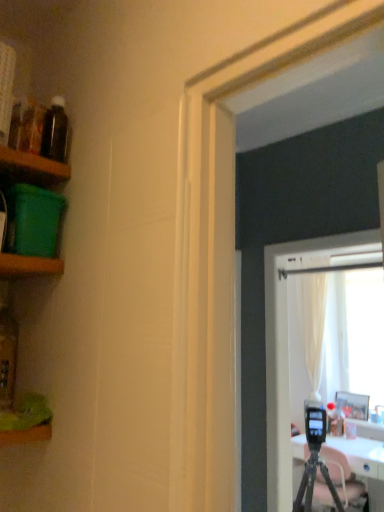
Question: Considering the relative sizes of green plastic container at left, marked as the 2th shelf in a bottom-to-top arrangement, and green plastic container at left, which ranks as the third shelf in bottom-to-top order, in the image provided, is green plastic container at left, marked as the 2th shelf in a bottom-to-top arrangement, thinner than green plastic container at left, which ranks as the third shelf in bottom-to-top order,?

Choices:
 (A) no
 (B) yes

Answer: (B)

Question: From the image's perspective, is green plastic container at left, which appears as the second shelf when viewed from the top, on green plastic container at left, the 1th shelf in the top-to-bottom sequence?

Choices:
 (A) yes
 (B) no

Answer: (B)

Question: Does green plastic container at left, which appears as the second shelf when viewed from the top, appear on the right side of green plastic container at left, the 1th shelf in the top-to-bottom sequence?

Choices:
 (A) no
 (B) yes

Answer: (B)

Question: Can green plastic container at left, the 1th shelf in the top-to-bottom sequence, be found inside green plastic container at left, marked as the 2th shelf in a bottom-to-top arrangement?

Choices:
 (A) yes
 (B) no

Answer: (B)

Question: Is green plastic container at left, which appears as the second shelf when viewed from the top, shorter than green plastic container at left, the 1th shelf in the top-to-bottom sequence?

Choices:
 (A) no
 (B) yes

Answer: (A)

Question: Looking at the image, does wooden picture frame at right seem bigger or smaller compared to green plastic container at left, which appears as the second shelf when viewed from the top?

Choices:
 (A) small
 (B) big

Answer: (B)

Question: Considering their positions, is wooden picture frame at right located in front of or behind green plastic container at left, which appears as the second shelf when viewed from the top?

Choices:
 (A) behind
 (B) front

Answer: (A)

Question: Is wooden picture frame at right situated inside green plastic container at left, marked as the 2th shelf in a bottom-to-top arrangement, or outside?

Choices:
 (A) outside
 (B) inside

Answer: (A)

Question: In terms of width, does wooden picture frame at right look wider or thinner when compared to green plastic container at left, marked as the 2th shelf in a bottom-to-top arrangement?

Choices:
 (A) thin
 (B) wide

Answer: (B)

Question: Considering the positions of black matte tripod at lower right and green plastic container at left, which ranks as the third shelf in bottom-to-top order, in the image, is black matte tripod at lower right wider or thinner than green plastic container at left, which ranks as the third shelf in bottom-to-top order,?

Choices:
 (A) thin
 (B) wide

Answer: (B)

Question: From a real-world perspective, is black matte tripod at lower right above or below green plastic container at left, which ranks as the third shelf in bottom-to-top order?

Choices:
 (A) above
 (B) below

Answer: (B)

Question: Considering the positions of point (329, 449) and point (31, 160), is point (329, 449) closer or farther from the camera than point (31, 160)?

Choices:
 (A) farther
 (B) closer

Answer: (A)

Question: From the image's perspective, is black matte tripod at lower right located above or below green plastic container at left, the 1th shelf in the top-to-bottom sequence?

Choices:
 (A) below
 (B) above

Answer: (A)

Question: From a real-world perspective, relative to green wood shelf at left, the 1th shelf ordered from the bottom, is translucent glass bottle at left, placed as the first bottle when sorted from left to right, vertically above or below?

Choices:
 (A) below
 (B) above

Answer: (A)

Question: In terms of width, does translucent glass bottle at left, placed as the first bottle when sorted from left to right, look wider or thinner when compared to green wood shelf at left, the 1th shelf ordered from the bottom?

Choices:
 (A) wide
 (B) thin

Answer: (B)